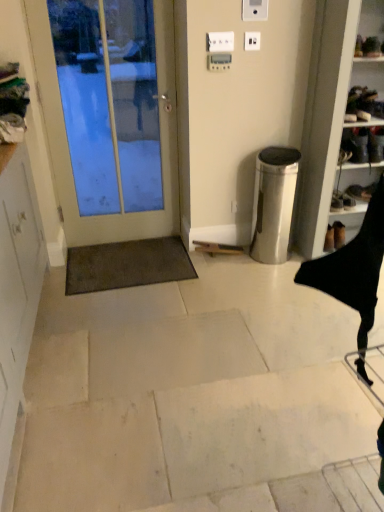
Question: From the image's perspective, is white matte cabinet at left on white plastic electric outlet at upper center, arranged as the first electric outlet when viewed from the left?

Choices:
 (A) yes
 (B) no

Answer: (B)

Question: Can you see white matte cabinet at left touching white plastic electric outlet at upper center, arranged as the first electric outlet when viewed from the left?

Choices:
 (A) yes
 (B) no

Answer: (B)

Question: Is white matte cabinet at left behind white plastic electric outlet at upper center, which appears as the 2th electric outlet when viewed from the right?

Choices:
 (A) yes
 (B) no

Answer: (B)

Question: From a real-world perspective, is white matte cabinet at left on top of white plastic electric outlet at upper center, which appears as the 2th electric outlet when viewed from the right?

Choices:
 (A) yes
 (B) no

Answer: (B)

Question: Does white matte cabinet at left have a lesser width compared to white plastic electric outlet at upper center, which appears as the 2th electric outlet when viewed from the right?

Choices:
 (A) no
 (B) yes

Answer: (A)

Question: Considering the relative positions of white matte cabinet at left and white glossy door at left in the image provided, is white matte cabinet at left to the left or to the right of white glossy door at left?

Choices:
 (A) right
 (B) left

Answer: (B)

Question: From the image's perspective, relative to white glossy door at left, is white matte cabinet at left above or below?

Choices:
 (A) above
 (B) below

Answer: (B)

Question: Is white matte cabinet at left wider or thinner than white glossy door at left?

Choices:
 (A) wide
 (B) thin

Answer: (A)

Question: Is point (11, 375) closer or farther from the camera than point (69, 245)?

Choices:
 (A) closer
 (B) farther

Answer: (A)

Question: Based on their sizes in the image, would you say black leather shoes at right is bigger or smaller than brown shaggy mat at lower left?

Choices:
 (A) small
 (B) big

Answer: (A)

Question: Do you think black leather shoes at right is within brown shaggy mat at lower left, or outside of it?

Choices:
 (A) inside
 (B) outside

Answer: (B)

Question: Is black leather shoes at right in front of or behind brown shaggy mat at lower left in the image?

Choices:
 (A) front
 (B) behind

Answer: (A)

Question: From their relative heights in the image, would you say black leather shoes at right is taller or shorter than brown shaggy mat at lower left?

Choices:
 (A) tall
 (B) short

Answer: (A)

Question: In the image, is black leather shoes at right on the left side or the right side of white plastic electric outlet at upper center, which is the second electric outlet in left-to-right order?

Choices:
 (A) left
 (B) right

Answer: (B)

Question: Relative to white plastic electric outlet at upper center, which appears as the 1th electric outlet when viewed from the right, is black leather shoes at right in front or behind?

Choices:
 (A) behind
 (B) front

Answer: (A)